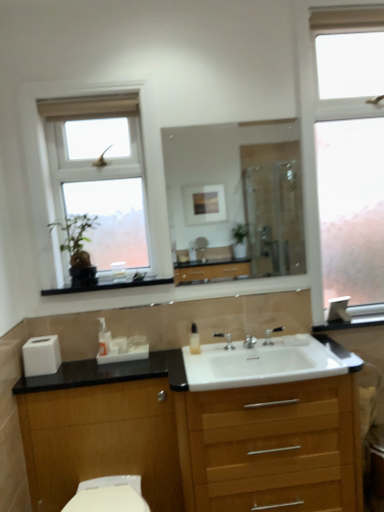
What do you see at coordinates (240, 190) in the screenshot?
I see `clear glass mirror at center` at bounding box center [240, 190].

Image resolution: width=384 pixels, height=512 pixels. I want to click on wooden chest of drawers at center, so click(272, 447).

I want to click on wooden cabinet at lower center, so click(x=101, y=440).

Based on the photo, from a real-world perspective, between frosted glass window at right, acting as the first window starting from the right, and translucent plastic soap dispenser at center, marked as the 1th soap dispenser in a right-to-left arrangement, who is vertically lower?

translucent plastic soap dispenser at center, marked as the 1th soap dispenser in a right-to-left arrangement.

Consider the image. Is frosted glass window at right, acting as the first window starting from the right, wider than translucent plastic soap dispenser at center, acting as the second soap dispenser starting from the left?

Indeed, frosted glass window at right, acting as the first window starting from the right, has a greater width compared to translucent plastic soap dispenser at center, acting as the second soap dispenser starting from the left.

From the image's perspective, is frosted glass window at right, acting as the first window starting from the right, on top of translucent plastic soap dispenser at center, acting as the second soap dispenser starting from the left?

Yes, from the image's perspective, frosted glass window at right, acting as the first window starting from the right, is on top of translucent plastic soap dispenser at center, acting as the second soap dispenser starting from the left.

Would you say frosted glass window at right, arranged as the second window when viewed from the left, is outside translucent plastic soap dispenser at center, marked as the 1th soap dispenser in a right-to-left arrangement?

Indeed, frosted glass window at right, arranged as the second window when viewed from the left, is completely outside translucent plastic soap dispenser at center, marked as the 1th soap dispenser in a right-to-left arrangement.

Do you think white glossy sink at center is within translucent plastic soap dispenser at center, acting as the second soap dispenser starting from the left, or outside of it?

white glossy sink at center cannot be found inside translucent plastic soap dispenser at center, acting as the second soap dispenser starting from the left.

Consider the image. Is white glossy sink at center positioned in front of translucent plastic soap dispenser at center, acting as the second soap dispenser starting from the left?

That is True.

Are white glossy sink at center and translucent plastic soap dispenser at center, acting as the second soap dispenser starting from the left, far apart?

No, white glossy sink at center is not far from translucent plastic soap dispenser at center, acting as the second soap dispenser starting from the left.

Is point (275, 382) positioned after point (194, 353)?

No, (275, 382) is in front of (194, 353).

Is clear glass mirror at center spatially inside white glossy sink at center, or outside of it?

clear glass mirror at center is outside white glossy sink at center.

Is clear glass mirror at center positioned behind white glossy sink at center?

Yes, it is.

Who is taller, clear glass mirror at center or white glossy sink at center?

With more height is clear glass mirror at center.

Is frosted glass window at right, acting as the first window starting from the right, surrounded by clear glass mirror at center?

No.

Is clear glass mirror at center not close to frosted glass window at right, acting as the first window starting from the right?

Absolutely, clear glass mirror at center is distant from frosted glass window at right, acting as the first window starting from the right.

Looking at this image, is clear glass mirror at center closer to the viewer compared to frosted glass window at right, acting as the first window starting from the right?

No.

Looking at their sizes, would you say clear glass mirror at center is wider or thinner than frosted glass window at right, acting as the first window starting from the right?

In the image, clear glass mirror at center appears to be more narrow than frosted glass window at right, acting as the first window starting from the right.

Could you tell me if white glossy toilet bowl at lower left is facing white glass window at upper left, acting as the second window starting from the right?

No, white glossy toilet bowl at lower left is not oriented towards white glass window at upper left, acting as the second window starting from the right.

Considering the sizes of white glossy toilet bowl at lower left and white glass window at upper left, positioned as the 1th window in left-to-right order, in the image, is white glossy toilet bowl at lower left wider or thinner than white glass window at upper left, positioned as the 1th window in left-to-right order,?

Clearly, white glossy toilet bowl at lower left has more width compared to white glass window at upper left, positioned as the 1th window in left-to-right order.

Is white glass window at upper left, acting as the second window starting from the right, surrounded by white glossy toilet bowl at lower left?

No.

Is white glossy toilet bowl at lower left far away from white glass window at upper left, positioned as the 1th window in left-to-right order?

Yes.

Relative to white glossy toilet bowl at lower left, is silver metallic tap at center, the 2th tap positioned from the right, in front or behind?

silver metallic tap at center, the 2th tap positioned from the right, is behind white glossy toilet bowl at lower left.

Considering the sizes of silver metallic tap at center, the 2th tap positioned from the right, and white glossy toilet bowl at lower left in the image, is silver metallic tap at center, the 2th tap positioned from the right, wider or thinner than white glossy toilet bowl at lower left?

Considering their sizes, silver metallic tap at center, the 2th tap positioned from the right, looks slimmer than white glossy toilet bowl at lower left.

How much distance is there between silver metallic tap at center, marked as the 1th tap in a left-to-right arrangement, and white glossy toilet bowl at lower left?

silver metallic tap at center, marked as the 1th tap in a left-to-right arrangement, and white glossy toilet bowl at lower left are 33.31 inches apart from each other.

From the image's perspective, is silver metallic tap at center, the 2th tap positioned from the right, above white glossy toilet bowl at lower left?

Indeed, from the image's perspective, silver metallic tap at center, the 2th tap positioned from the right, is shown above white glossy toilet bowl at lower left.

From a real-world perspective, which object rests below the other?

wooden cabinet at lower center, from a real-world perspective.

From the image's perspective, is wooden cabinet at lower center positioned above or below silver metallic tap at center, which is counted as the 1th tap, starting from the right?

From the image's perspective, wooden cabinet at lower center appears below silver metallic tap at center, which is counted as the 1th tap, starting from the right.

Consider the image. Considering the positions of objects wooden cabinet at lower center and silver metallic tap at center, which is counted as the 1th tap, starting from the right, in the image provided, who is more to the right, wooden cabinet at lower center or silver metallic tap at center, which is counted as the 1th tap, starting from the right,?

silver metallic tap at center, which is counted as the 1th tap, starting from the right, is more to the right.

In the image, there is a silver metallic tap at center, which is the second tap from left to right. Where is `cabinetry below it (from a real-world perspective)`? cabinetry below it (from a real-world perspective) is located at coordinates (101, 440).

Find the location of a particular element. The width and height of the screenshot is (384, 512). soap dispenser that is the 1st object to the left of the frosted glass window at right, acting as the first window starting from the right, starting at the anchor is located at coordinates (194, 340).

Find the location of a particular element. The height and width of the screenshot is (512, 384). the 2nd soap dispenser behind the white glossy sink at center is located at coordinates (194, 340).

From the image, which object appears to be nearer to white glass window at upper left, positioned as the 1th window in left-to-right order, wooden chest of drawers at center or silver metallic tap at center, which is counted as the 1th tap, starting from the right?

Among the two, wooden chest of drawers at center is located nearer to white glass window at upper left, positioned as the 1th window in left-to-right order.

From the image, which object appears to be nearer to silver metallic tap at center, the 2th tap positioned from the right, wooden chest of drawers at center or clear glass mirror at center?

wooden chest of drawers at center lies closer to silver metallic tap at center, the 2th tap positioned from the right, than the other object.

Based on their spatial positions, is silver metallic tap at center, which is counted as the 1th tap, starting from the right, or wooden cabinet at lower center further from frosted glass window at right, arranged as the second window when viewed from the left?

wooden cabinet at lower center lies further to frosted glass window at right, arranged as the second window when viewed from the left, than the other object.

Looking at the image, which one is located further to white glossy toilet bowl at lower left, frosted glass window at right, acting as the first window starting from the right, or silver metallic tap at center, which is counted as the 1th tap, starting from the right?

Result: frosted glass window at right, acting as the first window starting from the right, lies further to white glossy toilet bowl at lower left than the other object.

Looking at this image, when comparing their distances from white glass window at upper left, acting as the second window starting from the right, does white matte toilet paper at lower left or translucent plastic soap dispenser at center, acting as the second soap dispenser starting from the left, seem further?

translucent plastic soap dispenser at center, acting as the second soap dispenser starting from the left, is further to white glass window at upper left, acting as the second window starting from the right.

From the picture: Looking at the image, which one is located further to white glossy toilet bowl at lower left, translucent plastic soap dispenser at center, arranged as the 1th soap dispenser when viewed from the left, or clear glass mirror at center?

Among the two, clear glass mirror at center is located further to white glossy toilet bowl at lower left.

From the image, which object appears to be nearer to frosted glass window at right, arranged as the second window when viewed from the left, white glossy sink at center or clear glass mirror at center?

white glossy sink at center.

Based on their spatial positions, is silver metallic tap at center, the 2th tap positioned from the right, or wooden chest of drawers at center further from silver metallic tap at center, which is the second tap from left to right?

Among the two, wooden chest of drawers at center is located further to silver metallic tap at center, which is the second tap from left to right.

This screenshot has width=384, height=512. I want to click on cabinetry between translucent plastic soap dispenser at center, acting as the second soap dispenser starting from the left, and white glossy toilet bowl at lower left from top to bottom, so click(x=101, y=440).

Identify the location of toilet bowl between white matte toilet paper at lower left and wooden chest of drawers at center in the horizontal direction. (109, 495).

Find the location of `cabinetry that lies between translucent plastic soap dispenser at center, arranged as the 1th soap dispenser when viewed from the left, and white glossy toilet bowl at lower left from top to bottom`. cabinetry that lies between translucent plastic soap dispenser at center, arranged as the 1th soap dispenser when viewed from the left, and white glossy toilet bowl at lower left from top to bottom is located at coordinates (101, 440).

Find the location of `mirror situated between white glass window at upper left, positioned as the 1th window in left-to-right order, and silver metallic tap at center, which is counted as the 1th tap, starting from the right, from left to right`. mirror situated between white glass window at upper left, positioned as the 1th window in left-to-right order, and silver metallic tap at center, which is counted as the 1th tap, starting from the right, from left to right is located at coordinates (240, 190).